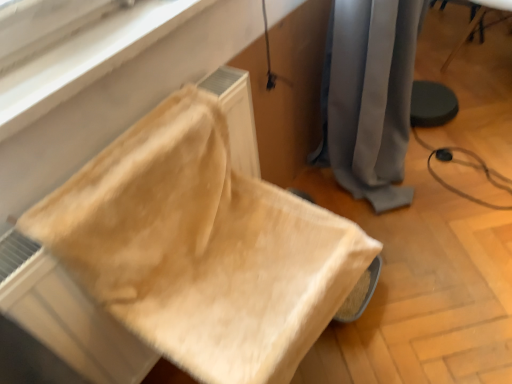
Question: Based on their sizes in the image, would you say beige fabric cushion at lower left, the second furniture positioned from the right, is bigger or smaller than gray fabric curtain at center?

Choices:
 (A) big
 (B) small

Answer: (B)

Question: Considering the positions of beige fabric cushion at lower left, which ranks as the 1th furniture in left-to-right order, and gray fabric curtain at center in the image, is beige fabric cushion at lower left, which ranks as the 1th furniture in left-to-right order, taller or shorter than gray fabric curtain at center?

Choices:
 (A) short
 (B) tall

Answer: (A)

Question: Estimate the real-world distances between objects in this image. Which object is closer to the gray fabric curtain at center?

Choices:
 (A) wooden chair at lower right, the first furniture when ordered from right to left
 (B) beige fabric cushion at lower left, which ranks as the 1th furniture in left-to-right order

Answer: (B)

Question: Which object is the farthest from the beige fabric cushion at lower left, the second furniture positioned from the right?

Choices:
 (A) gray fabric curtain at center
 (B) wooden chair at lower right, the 2th furniture positioned from the bottom

Answer: (B)